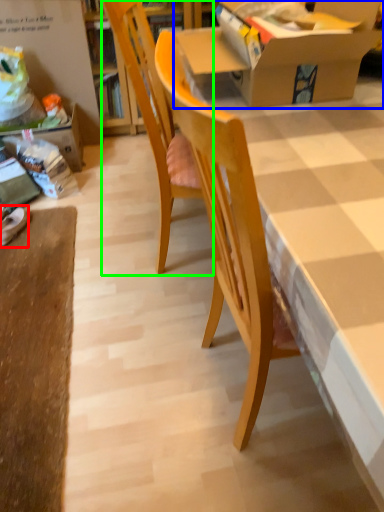
Question: Which object is the closest to the footwear (highlighted by a red box)? Choose among these: box (highlighted by a blue box) or chair (highlighted by a green box).

Choices:
 (A) box
 (B) chair

Answer: (B)